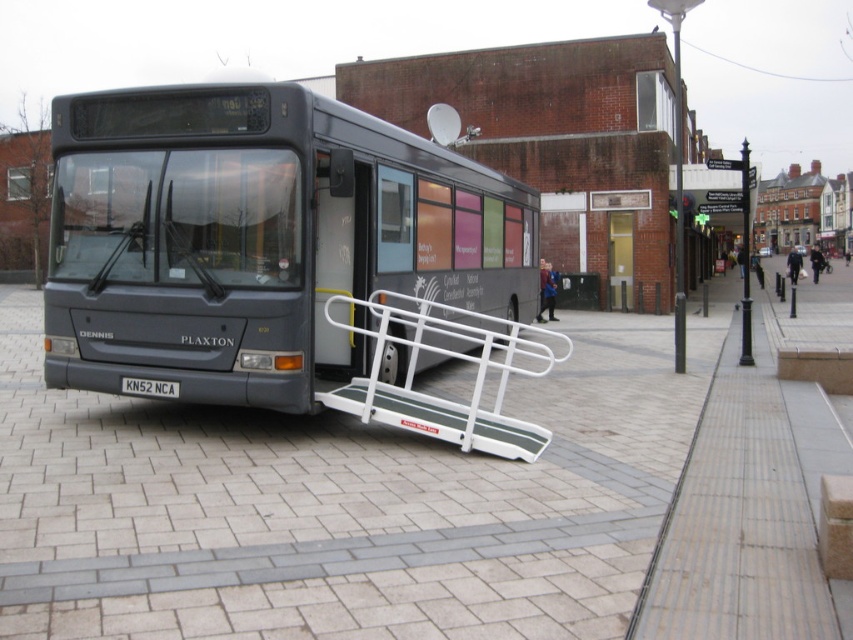
Question: Is gray brick pavement at center above black metal pole at upper right?

Choices:
 (A) no
 (B) yes

Answer: (A)

Question: Based on their relative distances, which object is farther from the matte black bus at center?

Choices:
 (A) white metallic ramp at center
 (B) gray brick pavement at center

Answer: (A)

Question: Among these points, which one is nearest to the camera?

Choices:
 (A) (57, 380)
 (B) (532, 436)

Answer: (B)

Question: Can you confirm if gray brick pavement at center is positioned to the right of black metal pole at upper right?

Choices:
 (A) yes
 (B) no

Answer: (B)

Question: Which object is positioned farthest from the black metal pole at upper right?

Choices:
 (A) white metallic ramp at center
 (B) gray brick pavement at center

Answer: (A)

Question: Does white metallic ramp at center have a greater width compared to black metal pole at upper right?

Choices:
 (A) yes
 (B) no

Answer: (B)